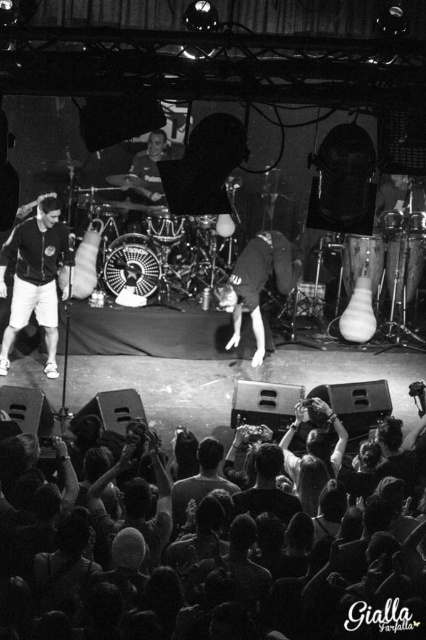
Between point (189, 573) and point (8, 259), which one is positioned in front?

Point (189, 573) is more forward.

Where is `dark textured crowd at lower center`? dark textured crowd at lower center is located at coordinates (233, 584).

What do you see at coordinates (233, 584) in the screenshot? I see `dark textured crowd at lower center` at bounding box center [233, 584].

The width and height of the screenshot is (426, 640). In order to click on dark textured crowd at lower center in this screenshot , I will do `click(233, 584)`.